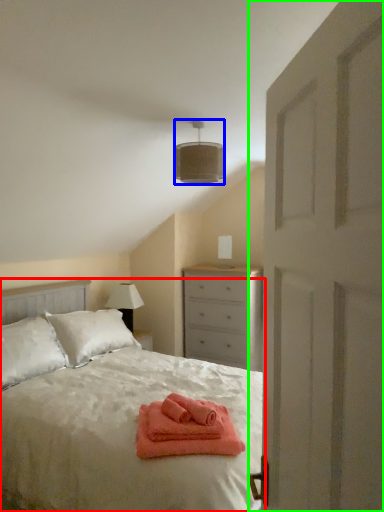
Question: Estimate the real-world distances between objects in this image. Which object is closer to bed (highlighted by a red box), lamp (highlighted by a blue box) or door (highlighted by a green box)?

Choices:
 (A) lamp
 (B) door

Answer: (A)